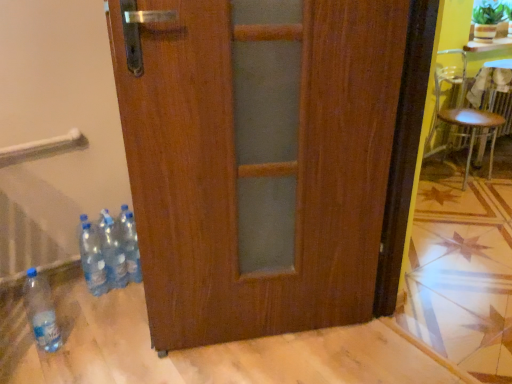
Where is `blank space to the left of transparent plastic bottles at lower left, marked as the third bottle in a right-to-left arrangement`? This screenshot has height=384, width=512. blank space to the left of transparent plastic bottles at lower left, marked as the third bottle in a right-to-left arrangement is located at coordinates click(67, 296).